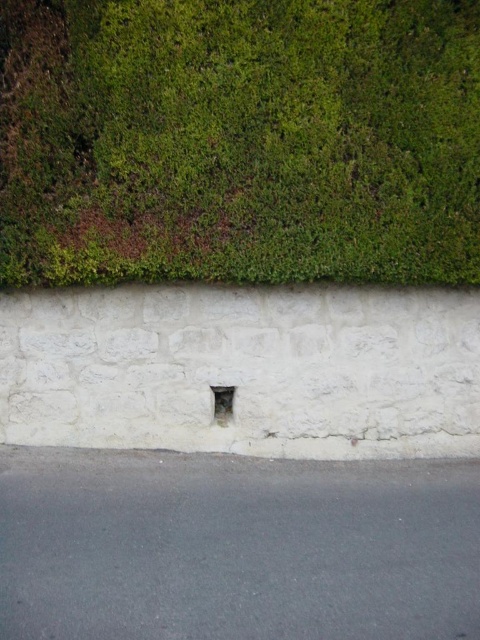
Question: Is the position of green mossy hedge at upper center less distant than that of white stone hole at center?

Choices:
 (A) no
 (B) yes

Answer: (B)

Question: Which point is farther to the camera?

Choices:
 (A) green mossy hedge at upper center
 (B) white stone hole at center

Answer: (B)

Question: Is green mossy hedge at upper center smaller than white stone hole at center?

Choices:
 (A) yes
 (B) no

Answer: (B)

Question: Does green mossy hedge at upper center appear on the left side of white stone hole at center?

Choices:
 (A) no
 (B) yes

Answer: (A)